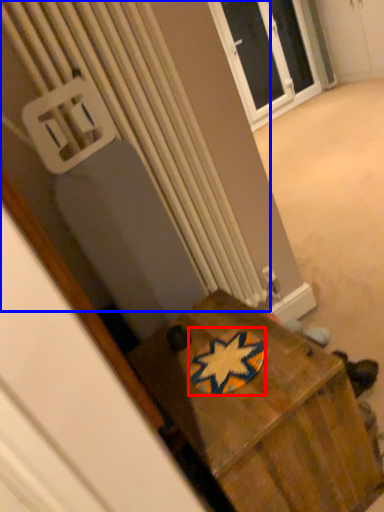
Question: Which object appears farthest to the camera in this image, design (highlighted by a red box) or radiator (highlighted by a blue box)?

Choices:
 (A) design
 (B) radiator

Answer: (B)